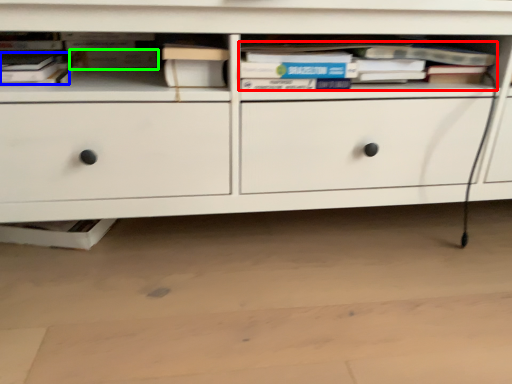
Question: Which object is the closest to the book (highlighted by a red box)? Choose among these: book (highlighted by a blue box) or paperback book (highlighted by a green box).

Choices:
 (A) book
 (B) paperback book

Answer: (B)